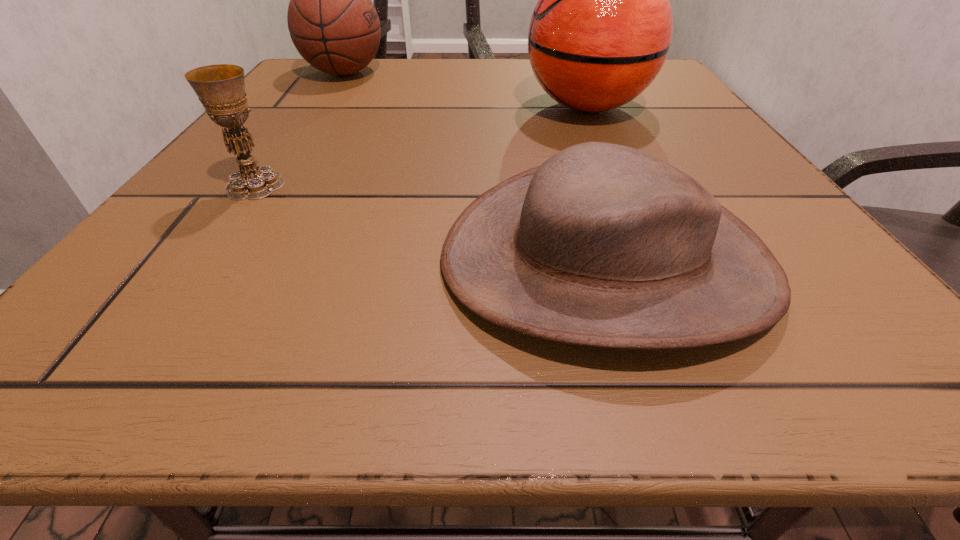
This screenshot has height=540, width=960. In the image, there is a desktop. What are the coordinates of `vacant space at the near edge` in the screenshot? It's located at (384, 334).

You are a GUI agent. You are given a task and a screenshot of the screen. Output one action in this format:
    pyautogui.click(x=<x>, y=<y>)
    Task: Click on the vacant space at the left edge of the desktop
    Image resolution: width=960 pixels, height=540 pixels.
    Given the screenshot: What is the action you would take?
    pyautogui.click(x=335, y=127)

Image resolution: width=960 pixels, height=540 pixels. What are the coordinates of `vacant space at the right edge` in the screenshot? It's located at (710, 122).

The image size is (960, 540). I want to click on free spot at the far left corner of the desktop, so click(x=308, y=70).

This screenshot has width=960, height=540. In the image, there is a desktop. Identify the location of vacant space at the near left corner. (222, 330).

The width and height of the screenshot is (960, 540). I want to click on vacant region between the second shortest object and the right basketball, so 421,146.

At what (x,y) coordinates should I click in order to perform the action: click on vacant space that's between the taller basketball and the shorter basketball. Please return your answer as a coordinate pair (x, y). Looking at the image, I should click on (466, 90).

At what (x,y) coordinates should I click in order to perform the action: click on vacant space that is in between the shorter basketball and the chalice. Please return your answer as a coordinate pair (x, y). The image size is (960, 540). Looking at the image, I should click on (300, 129).

Locate an element on the screen. This screenshot has height=540, width=960. free space between the shorter basketball and the taller basketball is located at coordinates (466, 90).

Identify the location of free space between the shortest object and the chalice. The height and width of the screenshot is (540, 960). (431, 222).